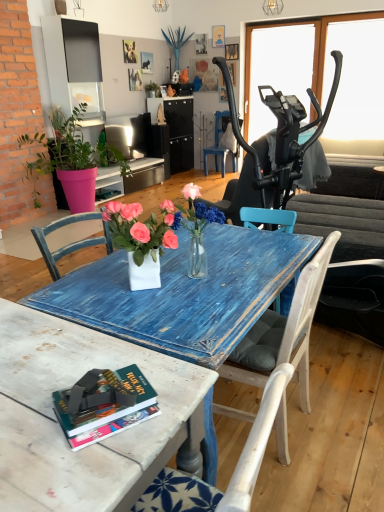
I want to click on free space behind hardcover book at lower left, so click(x=113, y=357).